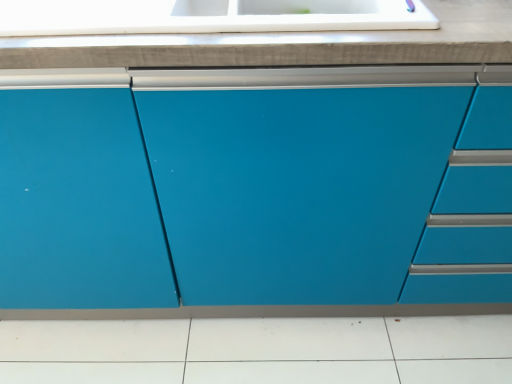
Question: From a real-world perspective, is matte blue cabinet at center under white glossy countertop at upper center?

Choices:
 (A) no
 (B) yes

Answer: (B)

Question: Are matte blue cabinet at center and white glossy countertop at upper center beside each other?

Choices:
 (A) yes
 (B) no

Answer: (B)

Question: From the image's perspective, is matte blue cabinet at center located beneath white glossy countertop at upper center?

Choices:
 (A) no
 (B) yes

Answer: (B)

Question: Is matte blue cabinet at center in front of white glossy countertop at upper center?

Choices:
 (A) yes
 (B) no

Answer: (A)

Question: Considering the relative sizes of matte blue cabinet at center and white glossy countertop at upper center in the image provided, is matte blue cabinet at center bigger than white glossy countertop at upper center?

Choices:
 (A) yes
 (B) no

Answer: (A)

Question: Does matte blue cabinet at center appear on the right side of white glossy countertop at upper center?

Choices:
 (A) yes
 (B) no

Answer: (A)

Question: Is white glossy countertop at upper center positioned before matte blue cabinet at center?

Choices:
 (A) no
 (B) yes

Answer: (A)

Question: Considering the relative sizes of white glossy countertop at upper center and matte blue cabinet at center in the image provided, is white glossy countertop at upper center bigger than matte blue cabinet at center?

Choices:
 (A) yes
 (B) no

Answer: (B)

Question: Is white glossy countertop at upper center to the left of matte blue cabinet at center from the viewer's perspective?

Choices:
 (A) no
 (B) yes

Answer: (B)

Question: Does white glossy countertop at upper center contain matte blue cabinet at center?

Choices:
 (A) no
 (B) yes

Answer: (A)

Question: Is white glossy countertop at upper center oriented towards matte blue cabinet at center?

Choices:
 (A) yes
 (B) no

Answer: (A)

Question: Is white glossy countertop at upper center next to matte blue cabinet at center and touching it?

Choices:
 (A) no
 (B) yes

Answer: (A)

Question: From the image's perspective, relative to white glossy countertop at upper center, is matte blue cabinet at center above or below?

Choices:
 (A) above
 (B) below

Answer: (B)